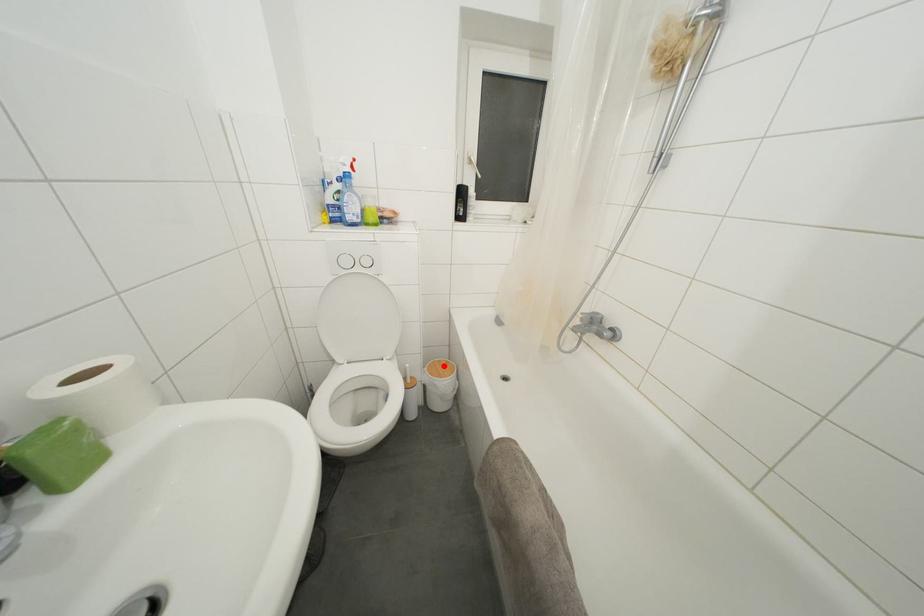
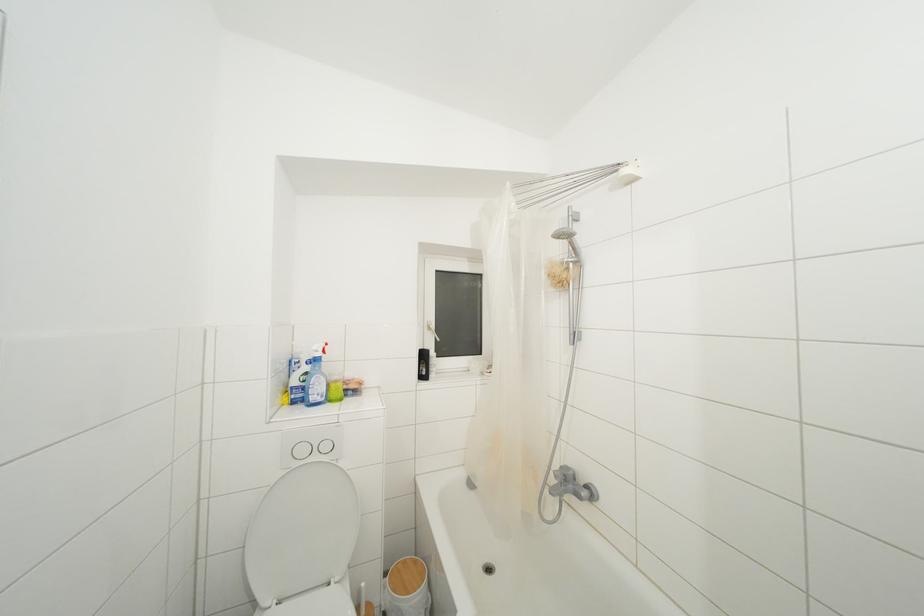
Locate, in the second image, the point that corresponds to the highlighted location in the first image.

(408, 567)